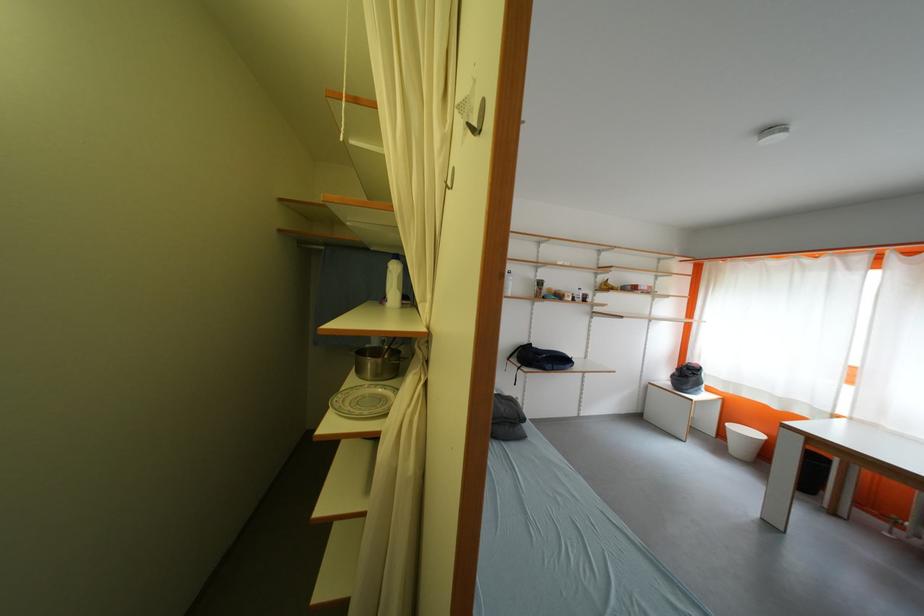
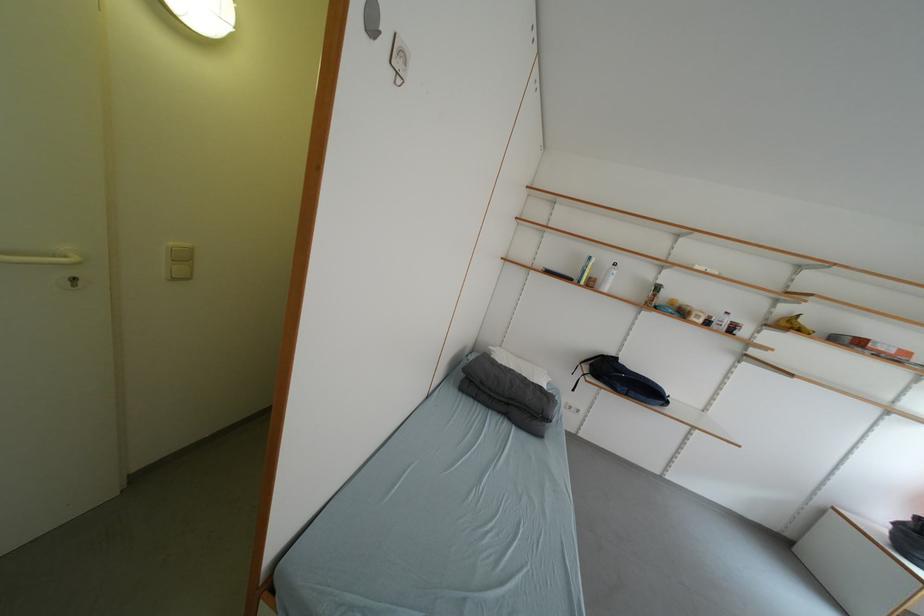
Question: The camera is either moving clockwise (left) or counter-clockwise (right) around the object. The first image is from the beginning of the video and the second image is from the end. Is the camera moving left or right when shooting the video?

Choices:
 (A) Left
 (B) Right

Answer: (B)